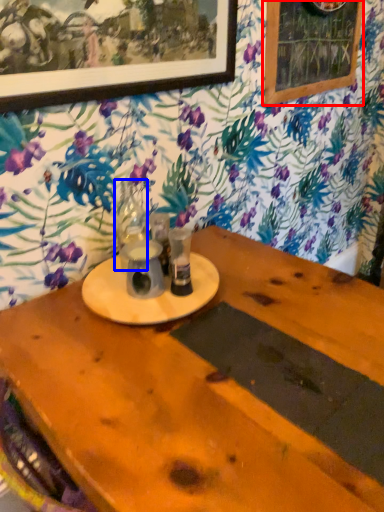
Question: Among these objects, which one is farthest to the camera, bulletin board (highlighted by a red box) or tableware (highlighted by a blue box)?

Choices:
 (A) bulletin board
 (B) tableware

Answer: (A)